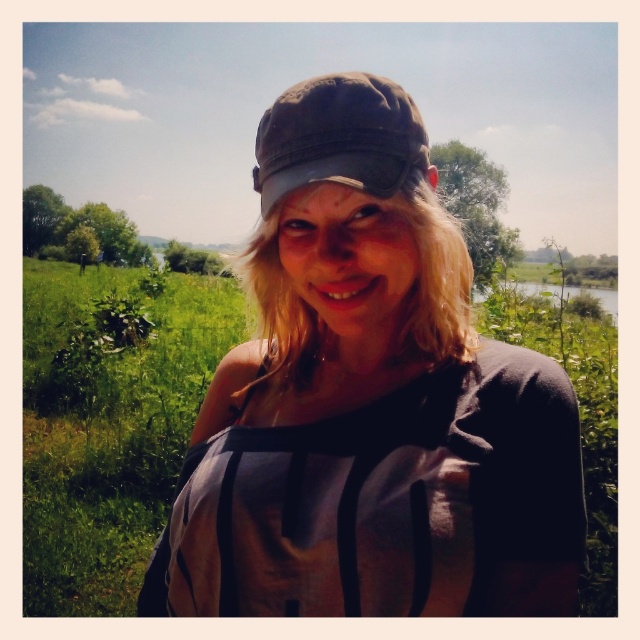
Question: Which point appears farthest from the camera in this image?

Choices:
 (A) (506, 552)
 (B) (268, 186)

Answer: (B)

Question: Which object is closer to the camera taking this photo?

Choices:
 (A) matte gray cap at center
 (B) dark brown fabric baseball cap at center

Answer: (A)

Question: Can you confirm if matte gray cap at center is positioned above dark brown fabric baseball cap at center?

Choices:
 (A) yes
 (B) no

Answer: (B)

Question: Among these points, which one is nearest to the camera?

Choices:
 (A) (410, 344)
 (B) (412, 164)

Answer: (B)

Question: Is matte gray cap at center closer to camera compared to dark brown fabric baseball cap at center?

Choices:
 (A) yes
 (B) no

Answer: (A)

Question: From the image, what is the correct spatial relationship of matte gray cap at center in relation to dark brown fabric baseball cap at center?

Choices:
 (A) below
 (B) above

Answer: (A)